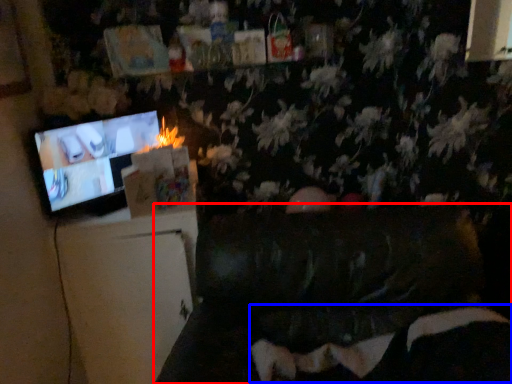
Question: Which object is closer to the camera taking this photo, furniture (highlighted by a red box) or bean bag chair (highlighted by a blue box)?

Choices:
 (A) furniture
 (B) bean bag chair

Answer: (A)